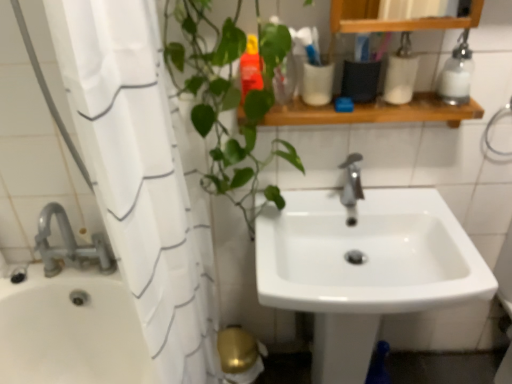
Question: In terms of size, does white glossy sink at center appear bigger or smaller than white fabric shower curtain at left?

Choices:
 (A) big
 (B) small

Answer: (A)

Question: Is white glossy sink at center wider or thinner than white fabric shower curtain at left?

Choices:
 (A) wide
 (B) thin

Answer: (A)

Question: Which object is the farthest from the green leafy plant at left?

Choices:
 (A) white glossy sink at center
 (B) wooden shelf at upper center
 (C) white glossy container at upper right, the first toiletry viewed from the right
 (D) translucent orange bottle at upper center, positioned as the 1th toiletry in left-to-right order
 (E) clear glass soap dispenser at upper right

Answer: (E)

Question: Which object is the farthest from the green leafy plant at left?

Choices:
 (A) white glossy container at upper right, which ranks as the second toiletry in left-to-right order
 (B) wooden shelf at upper center
 (C) white glossy sink at center
 (D) translucent orange bottle at upper center, placed as the second toiletry when sorted from right to left
 (E) white fabric shower curtain at left

Answer: (A)